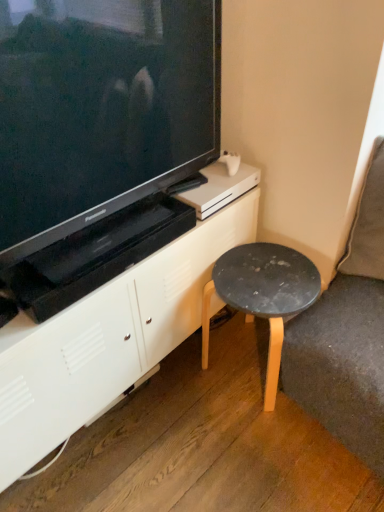
Question: Does black matte stool at lower right have a lesser height compared to white matte cabinet at center?

Choices:
 (A) yes
 (B) no

Answer: (A)

Question: From a real-world perspective, does black matte stool at lower right stand above white matte cabinet at center?

Choices:
 (A) yes
 (B) no

Answer: (B)

Question: Is black matte stool at lower right positioned beyond the bounds of white matte cabinet at center?

Choices:
 (A) yes
 (B) no

Answer: (A)

Question: Is black matte stool at lower right looking in the opposite direction of white matte cabinet at center?

Choices:
 (A) no
 (B) yes

Answer: (A)

Question: Is black matte stool at lower right beside white matte cabinet at center?

Choices:
 (A) no
 (B) yes

Answer: (A)

Question: Is black matte stool at lower right thinner than white matte cabinet at center?

Choices:
 (A) no
 (B) yes

Answer: (B)

Question: Is white matte cabinet at center at the right side of black matte stool at lower right?

Choices:
 (A) no
 (B) yes

Answer: (A)

Question: Is white matte cabinet at center wider than black matte stool at lower right?

Choices:
 (A) no
 (B) yes

Answer: (B)

Question: Can you confirm if white matte cabinet at center is taller than black matte stool at lower right?

Choices:
 (A) no
 (B) yes

Answer: (B)

Question: From a real-world perspective, is white matte cabinet at center positioned under black matte stool at lower right based on gravity?

Choices:
 (A) no
 (B) yes

Answer: (A)

Question: Is black matte stool at lower right completely or partially inside white matte cabinet at center?

Choices:
 (A) no
 (B) yes

Answer: (A)

Question: Does white matte cabinet at center have a smaller size compared to black matte stool at lower right?

Choices:
 (A) yes
 (B) no

Answer: (B)

Question: Is the position of black matte stool at lower right more distant than that of matte black television at upper left?

Choices:
 (A) yes
 (B) no

Answer: (A)